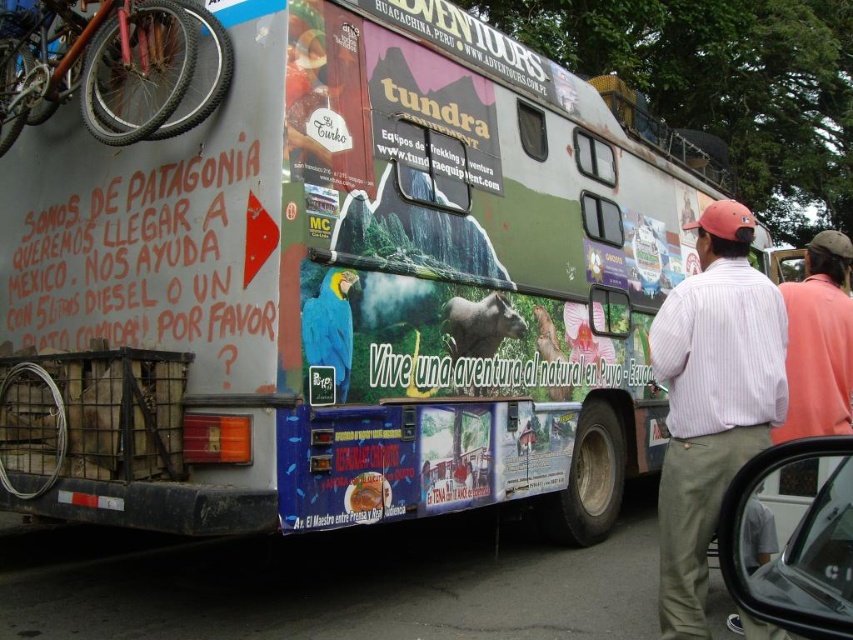
You are a traveler standing near the bus and want to compare the height of the striped cotton shirt at right and the orange matte bicycle at upper left. Which one is taller?

The striped cotton shirt at right is taller than the orange matte bicycle at upper left according to the description.

You are standing at the camera position and want to pick up the striped cotton shirt at right. Is it within your immediate reach?

The striped cotton shirt at right is 10.77 feet away from the camera, so it is too far to reach immediately. You would need to move closer.